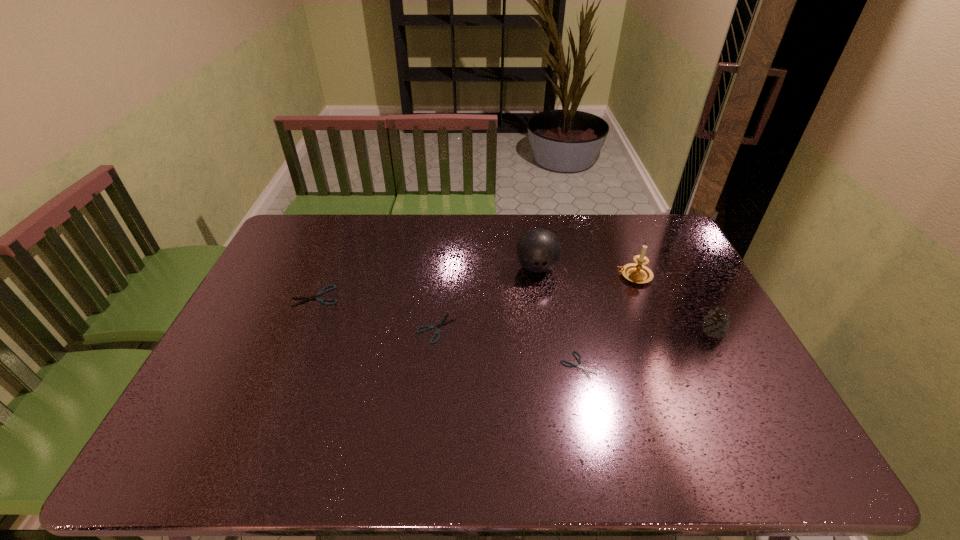
This screenshot has height=540, width=960. I want to click on vacant point located between the bowling ball and the fifth object from left to right, so click(x=586, y=272).

What are the coordinates of `vacant space that's between the tallest shears and the second tallest shears` in the screenshot? It's located at (376, 312).

Identify the location of empty space that is in between the bowling ball and the candle holder. The image size is (960, 540). (586, 272).

Where is `empty location between the third shortest object and the bowling ball`? The image size is (960, 540). empty location between the third shortest object and the bowling ball is located at coordinates (426, 282).

Where is `free space that is in between the third tallest object and the bowling ball`? free space that is in between the third tallest object and the bowling ball is located at coordinates (624, 300).

Where is `vacant area that lies between the tallest shears and the pinecone`? The width and height of the screenshot is (960, 540). vacant area that lies between the tallest shears and the pinecone is located at coordinates (514, 314).

The image size is (960, 540). What are the coordinates of `object that is the fifth closest to the fifth object from left to right` in the screenshot? It's located at (334, 286).

Where is `object identified as the fifth closest to the farthest shears`? The width and height of the screenshot is (960, 540). object identified as the fifth closest to the farthest shears is located at coordinates (715, 324).

You are a GUI agent. You are given a task and a screenshot of the screen. Output one action in this format:
    pyautogui.click(x=<x>, y=<y>)
    Task: Click on the shears object that ranks as the closest to the candle holder
    Image resolution: width=960 pixels, height=540 pixels.
    Given the screenshot: What is the action you would take?
    pyautogui.click(x=579, y=360)

Choose which shears is the third nearest neighbor to the fifth object from left to right. Please provide its 2D coordinates. Your answer should be formatted as a tuple, i.e. [(x, y)], where the tuple contains the x and y coordinates of a point satisfying the conditions above.

[(334, 286)]